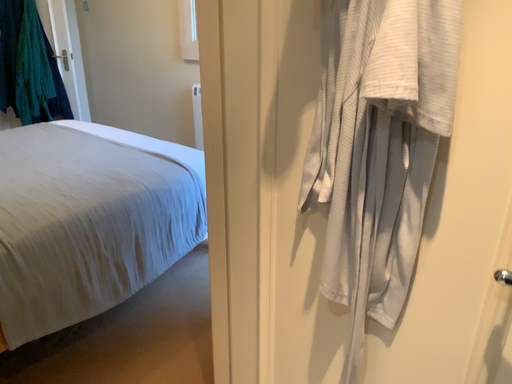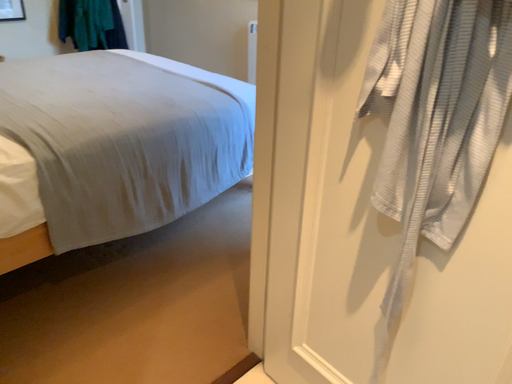
Question: Which way did the camera rotate in the video?

Choices:
 (A) rotated left
 (B) rotated right

Answer: (A)